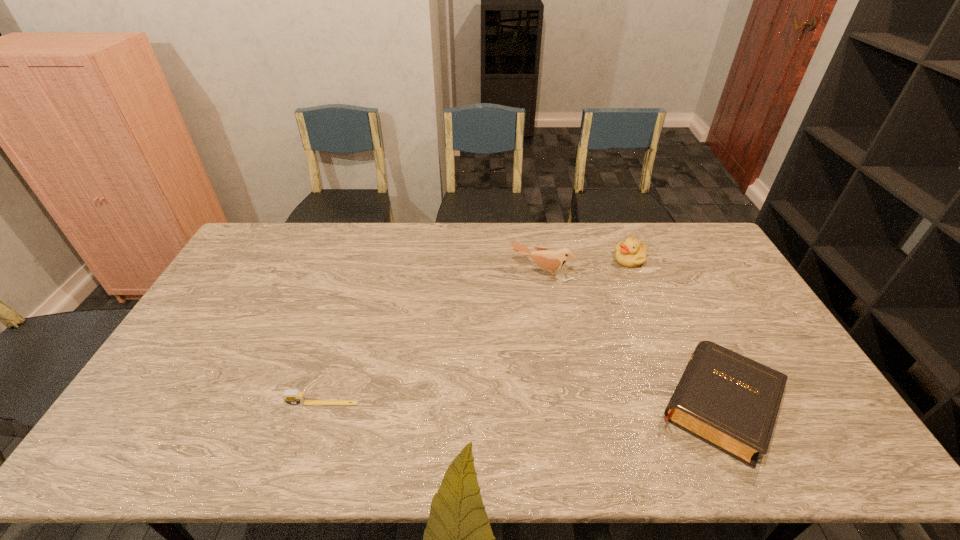
You are a GUI agent. You are given a task and a screenshot of the screen. Output one action in this format:
    pyautogui.click(x=<x>, y=<y>)
    Task: Click on the free location at the right edge
    This screenshot has height=540, width=960.
    Given the screenshot: What is the action you would take?
    pyautogui.click(x=703, y=297)

Where is `free location at the far left corner`? Image resolution: width=960 pixels, height=540 pixels. free location at the far left corner is located at coordinates (273, 253).

Identify the location of vacant area at the near left corner. (147, 399).

The width and height of the screenshot is (960, 540). I want to click on vacant space at the far right corner of the desktop, so click(664, 229).

The image size is (960, 540). What are the coordinates of `empty location between the shortest object and the third tallest object` in the screenshot? It's located at (520, 404).

This screenshot has height=540, width=960. In order to click on vacant space that is in between the tallest object and the leftmost object in this screenshot , I will do 432,338.

Locate an element on the screen. vacant space that is in between the leftmost object and the bird is located at coordinates (432, 338).

You are a GUI agent. You are given a task and a screenshot of the screen. Output one action in this format:
    pyautogui.click(x=<x>, y=<y>)
    Task: Click on the free point between the leftmost object and the Bible
    The width and height of the screenshot is (960, 540).
    Given the screenshot: What is the action you would take?
    pyautogui.click(x=520, y=404)

Identify the location of vacant point located between the duckling and the second object from left to right. The height and width of the screenshot is (540, 960). (586, 266).

Image resolution: width=960 pixels, height=540 pixels. In order to click on free spot between the leftmost object and the Bible in this screenshot , I will do `click(520, 404)`.